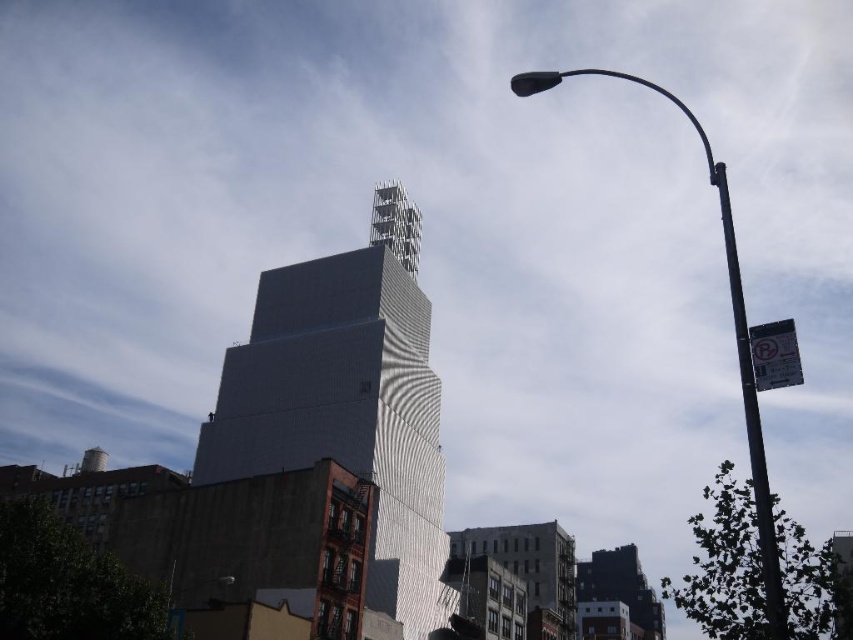
Question: Is metallic pole at right to the left of metallic street light at upper right from the viewer's perspective?

Choices:
 (A) yes
 (B) no

Answer: (B)

Question: Can you confirm if silver metallic building at center is thinner than black metal pole at right?

Choices:
 (A) no
 (B) yes

Answer: (B)

Question: Which of these objects is positioned farthest from the metallic pole at right?

Choices:
 (A) metallic street light at upper right
 (B) black metal pole at right
 (C) silver metallic building at center

Answer: (A)

Question: Which of the following is the closest to the observer?

Choices:
 (A) (375, 420)
 (B) (543, 76)
 (C) (730, 272)

Answer: (C)

Question: Does silver metallic building at center appear under black metal pole at right?

Choices:
 (A) yes
 (B) no

Answer: (A)

Question: Among these points, which one is nearest to the camera?

Choices:
 (A) (758, 435)
 (B) (737, 330)
 (C) (326, 387)
 (D) (180, 628)

Answer: (A)